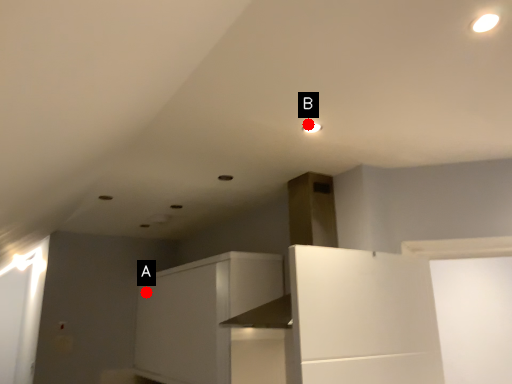
Question: Two points are circled on the image, labeled by A and B beside each circle. Which point is farther to the camera?

Choices:
 (A) A is further
 (B) B is further

Answer: (A)